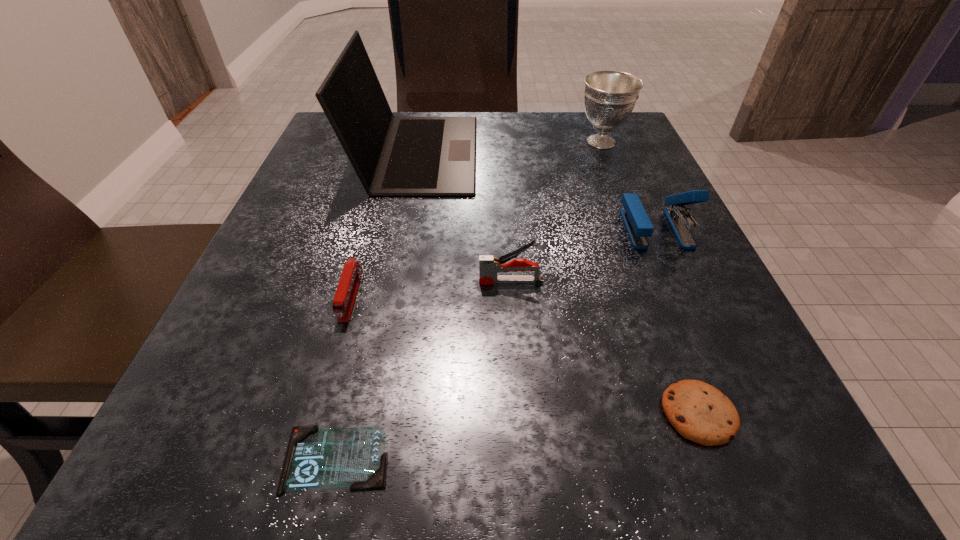
The width and height of the screenshot is (960, 540). What are the coordinates of `vacant space located on the front of the chalice` in the screenshot? It's located at (631, 217).

Locate an element on the screen. vacant space located 0.320m on the front of the third farthest object is located at coordinates (751, 441).

At what (x,y) coordinates should I click in order to perform the action: click on vacant space located 0.270m on the handle side of the fourth object from right to left. Please return your answer as a coordinate pair (x, y). Looking at the image, I should click on (300, 281).

At what (x,y) coordinates should I click in order to perform the action: click on vacant space located on the handle side of the fourth object from right to left. Please return your answer as a coordinate pair (x, y). The width and height of the screenshot is (960, 540). Looking at the image, I should click on (347, 281).

Image resolution: width=960 pixels, height=540 pixels. I want to click on free spot located on the handle side of the fourth object from right to left, so click(274, 281).

Where is `blank space located on the front-facing side of the leftmost stapler`? This screenshot has height=540, width=960. blank space located on the front-facing side of the leftmost stapler is located at coordinates (314, 426).

What are the coordinates of `vacant space located on the right of the cookie` in the screenshot? It's located at (785, 414).

Locate an element on the screen. This screenshot has height=540, width=960. free space located 0.270m on the back of the shortest object is located at coordinates (381, 264).

Find the location of a particular element. laptop at the far edge is located at coordinates (393, 156).

Locate an element on the screen. Image resolution: width=960 pixels, height=540 pixels. chalice that is at the far edge is located at coordinates (610, 96).